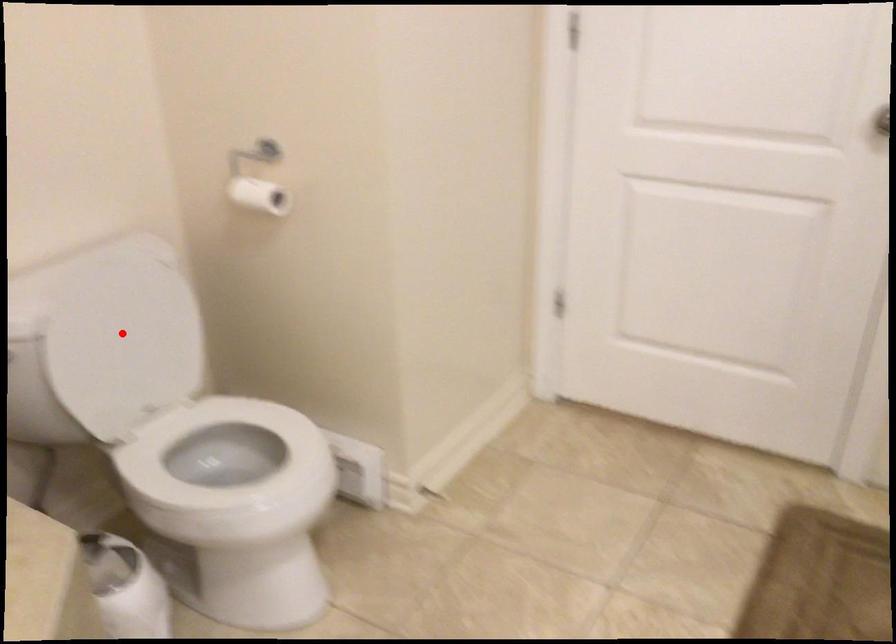
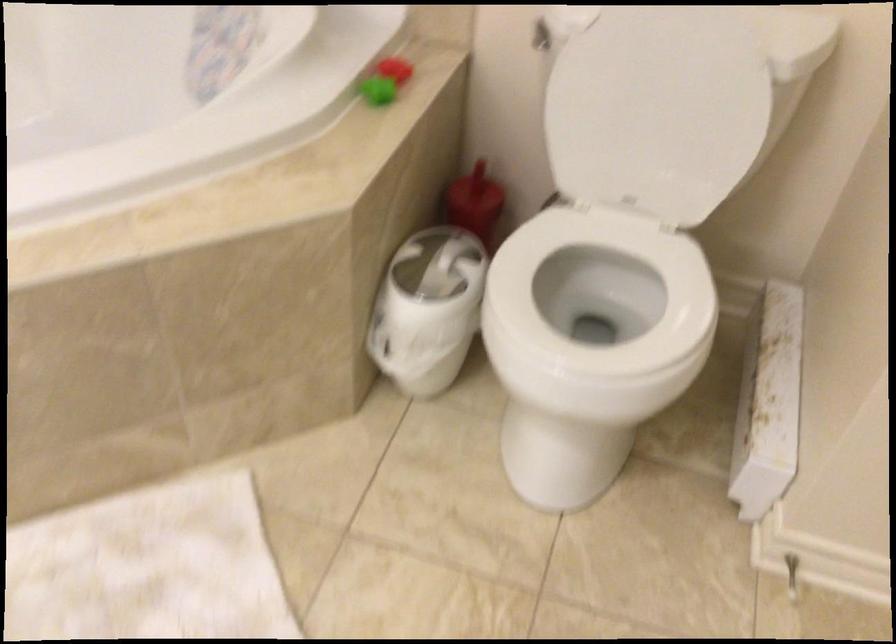
Question: I am providing you with two images of the same scene from different viewpoints. Image1 has a red point marked. In image2, the corresponding 3D location appears at what relative position? Reply with the corresponding letter.

Choices:
 (A) Closer
 (B) Farther

Answer: (A)